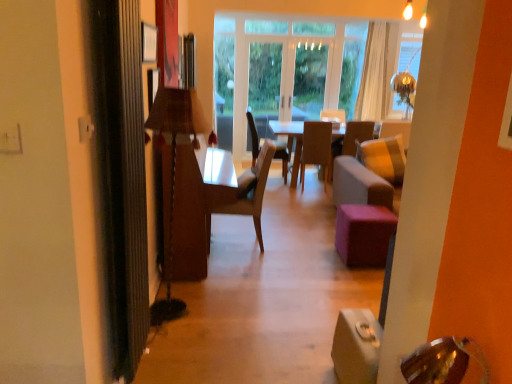
Image resolution: width=512 pixels, height=384 pixels. In order to click on vacant area that lies between light brown wood chair at center, the third chair viewed from the back, and purple fabric stool at center in this screenshot , I will do `click(297, 246)`.